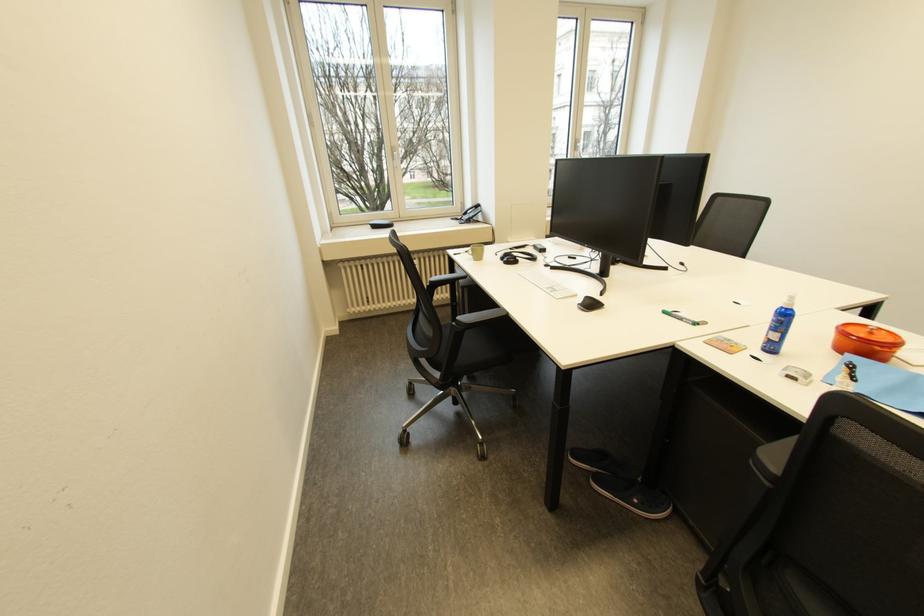
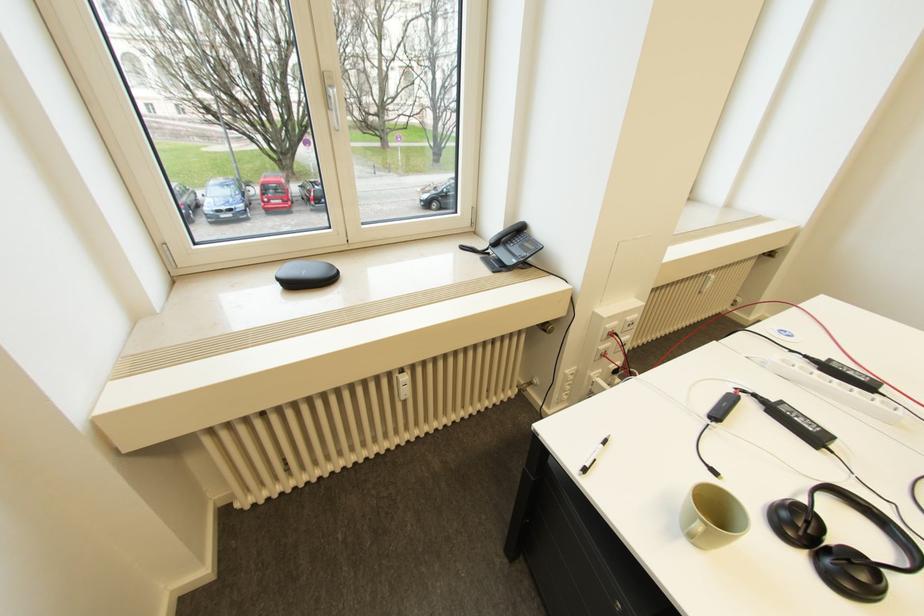
Question: In a continuous first-person perspective shot, in which direction is the camera moving?

Choices:
 (A) Left
 (B) Right
 (C) Forward
 (D) Backward

Answer: (C)